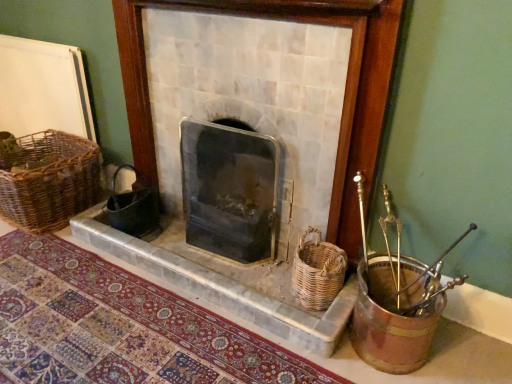
Question: Would you say black glass wood burning stove at center is to the left or to the right of white marble fireplace at center in the picture?

Choices:
 (A) left
 (B) right

Answer: (A)

Question: Is black glass wood burning stove at center inside or outside of white marble fireplace at center?

Choices:
 (A) outside
 (B) inside

Answer: (A)

Question: Estimate the real-world distances between objects in this image. Which object is closer to the white marble fireplace at center?

Choices:
 (A) black wicker gift basket at center
 (B) patterned carpet at lower left
 (C) woven brown basket at left, marked as the first basket in a back-to-front arrangement
 (D) woven brown basket at lower right, acting as the 1th basket starting from the front
 (E) black glass wood burning stove at center

Answer: (E)

Question: Which object is positioned farthest from the black wicker gift basket at center?

Choices:
 (A) patterned carpet at lower left
 (B) woven brown basket at left, which is the first basket in left-to-right order
 (C) black glass wood burning stove at center
 (D) woven brown basket at lower right, marked as the 1th basket in a right-to-left arrangement
 (E) white marble fireplace at center

Answer: (D)